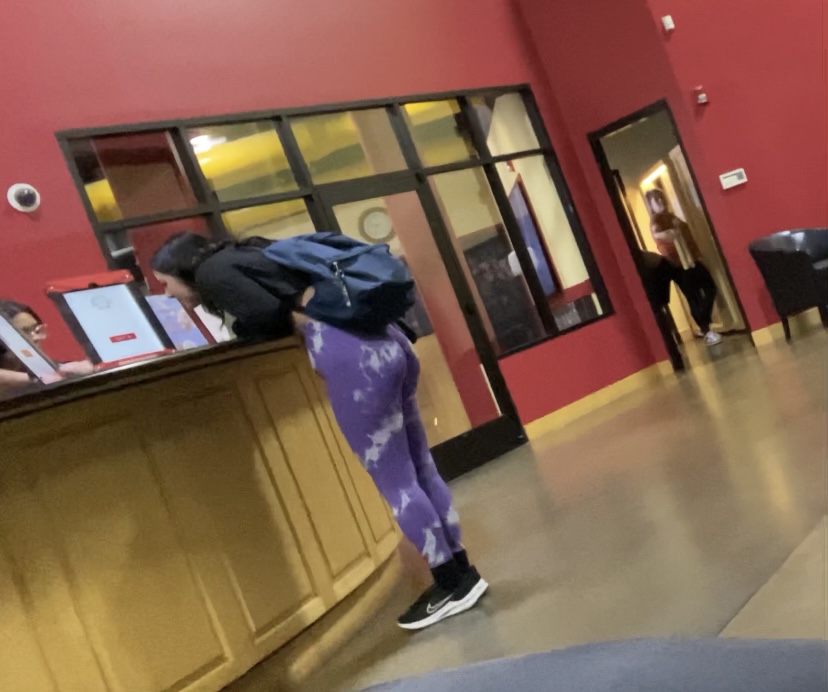
I want to click on light in hallway, so click(x=204, y=143).